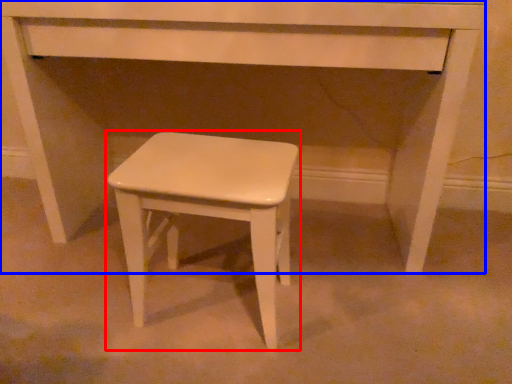
Question: Among these objects, which one is nearest to the camera, stool (highlighted by a red box) or table (highlighted by a blue box)?

Choices:
 (A) stool
 (B) table

Answer: (A)